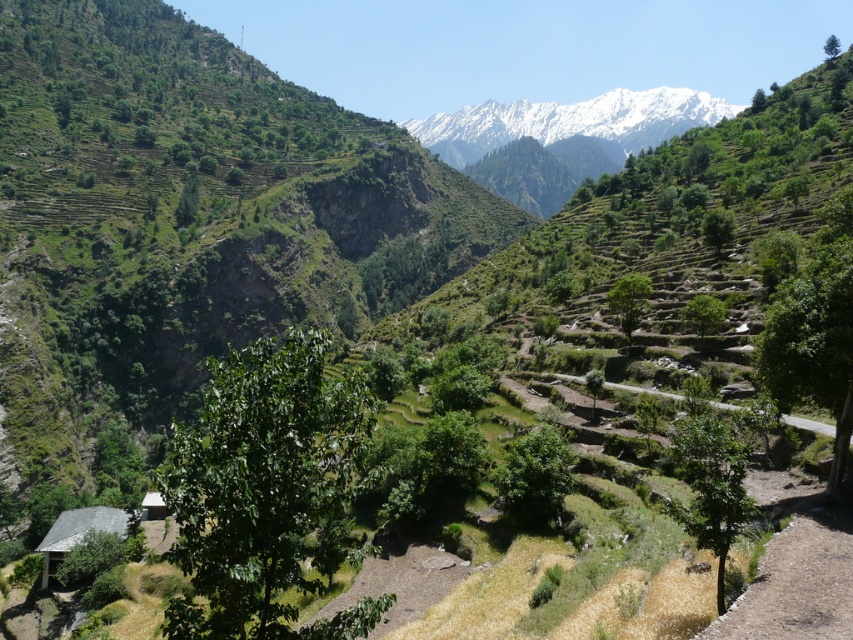
Describe the element at coordinates (570, 122) in the screenshot. I see `white snow-covered mountain at upper center` at that location.

In order to click on white snow-covered mountain at upper center in this screenshot , I will do coord(570,122).

I want to click on white snow-covered mountain at upper center, so click(570, 122).

Can you confirm if white snow-covered mountain at upper center is wider than gray slate hut at lower left?

Correct, the width of white snow-covered mountain at upper center exceeds that of gray slate hut at lower left.

Who is more distant from viewer, [608,106] or [53,557]?

The point [608,106] is more distant.

Find the location of a particular element. This screenshot has width=853, height=640. white snow-covered mountain at upper center is located at coordinates (570, 122).

Does gray slate hut at lower left have a smaller size compared to white wooden hut at lower left?

Incorrect, gray slate hut at lower left is not smaller in size than white wooden hut at lower left.

Who is more forward, (x=119, y=524) or (x=151, y=509)?

Point (x=119, y=524) is more forward.

Image resolution: width=853 pixels, height=640 pixels. What do you see at coordinates (77, 532) in the screenshot?
I see `gray slate hut at lower left` at bounding box center [77, 532].

This screenshot has height=640, width=853. Identify the location of gray slate hut at lower left. [77, 532].